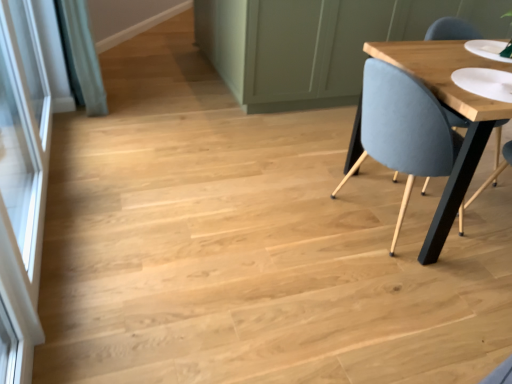
Question: In the image, is light blue fabric chair at right positioned in front of or behind transparent glass screen door at left?

Choices:
 (A) behind
 (B) front

Answer: (A)

Question: Is light blue fabric chair at right taller or shorter than transparent glass screen door at left?

Choices:
 (A) tall
 (B) short

Answer: (B)

Question: From a real-world perspective, relative to transparent glass screen door at left, is light blue fabric chair at right vertically above or below?

Choices:
 (A) below
 (B) above

Answer: (A)

Question: Choose the correct answer: Is transparent glass screen door at left inside light blue fabric chair at right or outside it?

Choices:
 (A) inside
 (B) outside

Answer: (B)

Question: From the image's perspective, is transparent glass screen door at left located above or below light blue fabric chair at right?

Choices:
 (A) above
 (B) below

Answer: (B)

Question: Based on their sizes in the image, would you say transparent glass screen door at left is bigger or smaller than light blue fabric chair at right?

Choices:
 (A) small
 (B) big

Answer: (A)

Question: In terms of width, does transparent glass screen door at left look wider or thinner when compared to light blue fabric chair at right?

Choices:
 (A) thin
 (B) wide

Answer: (A)